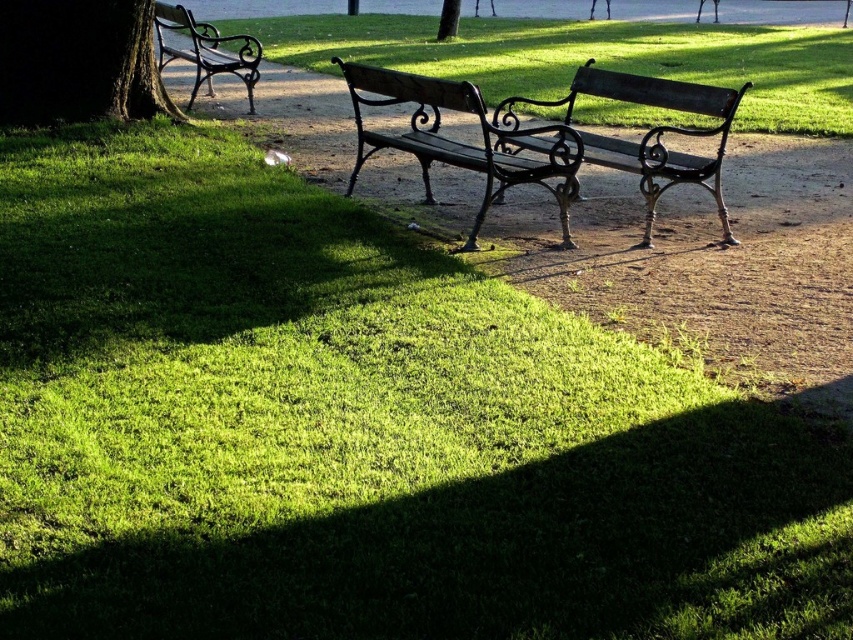
You are planning to place a large picnic blanket on the green grass at center and the matte black bench at center. Which surface will allow you to spread the blanket more comfortably?

The green grass at center is wider than the matte black bench at center, so you can spread the blanket more comfortably on the green grass at center.